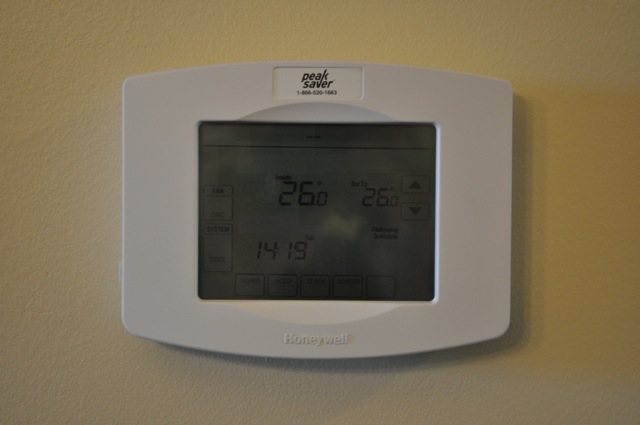
Identify the location of shadow on wall. The width and height of the screenshot is (640, 425). (515, 253).